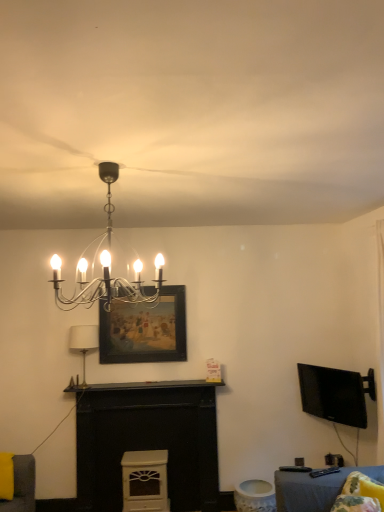
The width and height of the screenshot is (384, 512). What do you see at coordinates (360, 495) in the screenshot? I see `fluffy yellow pillow at lower right` at bounding box center [360, 495].

What do you see at coordinates (148, 441) in the screenshot?
I see `white matte fireplace at center` at bounding box center [148, 441].

Where is `white fabric lampshade at center-left, acting as the second lamp starting from the right`? white fabric lampshade at center-left, acting as the second lamp starting from the right is located at coordinates (83, 342).

Find the location of `fluffy yellow pillow at lower right`. fluffy yellow pillow at lower right is located at coordinates (360, 495).

Considering the sizes of objects black glossy tv at right and white matte fireplace at center in the image provided, who is smaller, black glossy tv at right or white matte fireplace at center?

Smaller between the two is black glossy tv at right.

Considering the positions of objects black glossy tv at right and white matte fireplace at center in the image provided, who is in front, black glossy tv at right or white matte fireplace at center?

black glossy tv at right is more forward.

Is black glossy tv at right spatially inside white matte fireplace at center, or outside of it?

black glossy tv at right is not inside white matte fireplace at center, it's outside.

From a real-world perspective, who is located higher, black glossy tv at right or white matte fireplace at center?

In real-world perspective, black glossy tv at right is above.

From a real-world perspective, which is physically below, fluffy yellow pillow at lower right or white matte fireplace at center?

white matte fireplace at center is physically lower.

Considering the relative sizes of fluffy yellow pillow at lower right and white matte fireplace at center in the image provided, is fluffy yellow pillow at lower right taller than white matte fireplace at center?

Incorrect, the height of fluffy yellow pillow at lower right is not larger of that of white matte fireplace at center.

Which object is closer to the camera, fluffy yellow pillow at lower right or white matte fireplace at center?

Positioned in front is fluffy yellow pillow at lower right.

Is fluffy yellow pillow at lower right looking in the opposite direction of white matte fireplace at center?

No.

Is white fabric lampshade at center-left, which ranks as the first lamp in left-to-right order, spatially inside white matte fireplace at center, or outside of it?

The correct answer is: outside.

Is white fabric lampshade at center-left, the 2th lamp positioned from the top, beside white matte fireplace at center?

No, white fabric lampshade at center-left, the 2th lamp positioned from the top, is not making contact with white matte fireplace at center.

Which is farther from the camera, (84, 346) or (136, 387)?

Point (84, 346)

Can you confirm if white fabric lampshade at center-left, which ranks as the first lamp in left-to-right order, is wider than white matte fireplace at center?

Indeed, white fabric lampshade at center-left, which ranks as the first lamp in left-to-right order, has a greater width compared to white matte fireplace at center.

Who is shorter, white fabric lampshade at center-left, which ranks as the first lamp in left-to-right order, or fluffy yellow pillow at lower right?

Standing shorter between the two is fluffy yellow pillow at lower right.

Can you confirm if white fabric lampshade at center-left, the 1th lamp from the bottom, is thinner than fluffy yellow pillow at lower right?

Yes.

Based on the photo, can you tell me how much black glossy tv at right and polished chrome chandelier at upper center, which is the first lamp in front-to-back order, differ in facing direction?

black glossy tv at right and polished chrome chandelier at upper center, which is the first lamp in front-to-back order, are facing 153 degrees away from each other.

From a real-world perspective, which is physically below, black glossy tv at right or polished chrome chandelier at upper center, placed as the first lamp when sorted from top to bottom?

black glossy tv at right is physically lower.

Considering the sizes of black glossy tv at right and polished chrome chandelier at upper center, placed as the 2th lamp when sorted from back to front, in the image, is black glossy tv at right wider or thinner than polished chrome chandelier at upper center, placed as the 2th lamp when sorted from back to front,?

black glossy tv at right is thinner than polished chrome chandelier at upper center, placed as the 2th lamp when sorted from back to front.

Which is behind, black glossy tv at right or polished chrome chandelier at upper center, placed as the 2th lamp when sorted from back to front?

black glossy tv at right is further from the camera.

From a real-world perspective, is wooden framed painting at center above or below fluffy yellow pillow at lower right?

In terms of real-world spatial position, wooden framed painting at center is above fluffy yellow pillow at lower right.

Can you confirm if wooden framed painting at center is shorter than fluffy yellow pillow at lower right?

No.

Considering the relative sizes of wooden framed painting at center and fluffy yellow pillow at lower right in the image provided, is wooden framed painting at center bigger than fluffy yellow pillow at lower right?

Indeed, wooden framed painting at center has a larger size compared to fluffy yellow pillow at lower right.

From the image's perspective, which is above, wooden framed painting at center or fluffy yellow pillow at lower right?

wooden framed painting at center appears higher in the image.

Is black glossy tv at right completely or partially outside of fluffy yellow pillow at lower right?

Yes.

Between point (359, 378) and point (335, 511), which one is positioned in front?

The point (335, 511) is closer.

In terms of height, does black glossy tv at right look taller or shorter compared to fluffy yellow pillow at lower right?

Clearly, black glossy tv at right is taller compared to fluffy yellow pillow at lower right.

Where is `television that is above the fluffy yellow pillow at lower right (from a real-world perspective)`? Image resolution: width=384 pixels, height=512 pixels. television that is above the fluffy yellow pillow at lower right (from a real-world perspective) is located at coordinates point(335,394).

Where is `fireplace below the black glossy tv at right (from the image's perspective)`? This screenshot has width=384, height=512. fireplace below the black glossy tv at right (from the image's perspective) is located at coordinates (148, 441).

Identify the location of fireplace that appears on the left of fluffy yellow pillow at lower right. The image size is (384, 512). (148, 441).

Which object lies further to the anchor point fluffy yellow pillow at lower right, white fabric lampshade at center-left, the 1th lamp from the bottom, or black glossy tv at right?

The object further to fluffy yellow pillow at lower right is white fabric lampshade at center-left, the 1th lamp from the bottom.

When comparing their distances from polished chrome chandelier at upper center, which ranks as the second lamp in bottom-to-top order, does white fabric lampshade at center-left, which is the first lamp in back-to-front order, or black glossy tv at right seem closer?

white fabric lampshade at center-left, which is the first lamp in back-to-front order, is positioned closer to the anchor polished chrome chandelier at upper center, which ranks as the second lamp in bottom-to-top order.

Estimate the real-world distances between objects in this image. Which object is closer to polished chrome chandelier at upper center, the 2th lamp from the left, white fabric lampshade at center-left, the 2th lamp positioned from the top, or wooden framed painting at center?

wooden framed painting at center lies closer to polished chrome chandelier at upper center, the 2th lamp from the left, than the other object.

Looking at the image, which one is located further to white matte fireplace at center, polished chrome chandelier at upper center, which ranks as the second lamp in bottom-to-top order, or black glossy tv at right?

polished chrome chandelier at upper center, which ranks as the second lamp in bottom-to-top order.

When comparing their distances from black glossy tv at right, does fluffy yellow pillow at lower right or white fabric lampshade at center-left, the 2th lamp positioned from the top, seem further?

The object further to black glossy tv at right is white fabric lampshade at center-left, the 2th lamp positioned from the top.

Based on their spatial positions, is wooden framed painting at center or white fabric lampshade at center-left, which is the first lamp in back-to-front order, closer to black glossy tv at right?

wooden framed painting at center is closer to black glossy tv at right.

When comparing their distances from fluffy yellow pillow at lower right, does polished chrome chandelier at upper center, which is the first lamp in front-to-back order, or white fabric lampshade at center-left, which is the first lamp in back-to-front order, seem closer?

Among the two, polished chrome chandelier at upper center, which is the first lamp in front-to-back order, is located nearer to fluffy yellow pillow at lower right.

Considering their positions, is fluffy yellow pillow at lower right positioned further to black glossy tv at right than wooden framed painting at center?

wooden framed painting at center is positioned further to the anchor black glossy tv at right.

The image size is (384, 512). In order to click on television between polished chrome chandelier at upper center, acting as the first lamp starting from the right, and wooden framed painting at center in the front-back direction in this screenshot , I will do `click(335, 394)`.

Where is `pillow between white matte fireplace at center and black glossy tv at right in the horizontal direction`? This screenshot has width=384, height=512. pillow between white matte fireplace at center and black glossy tv at right in the horizontal direction is located at coordinates (360, 495).

Identify the location of lamp located between white fabric lampshade at center-left, the second lamp from the front, and fluffy yellow pillow at lower right in the left-right direction. This screenshot has width=384, height=512. (101, 285).

Locate an element on the screen. television between polished chrome chandelier at upper center, the 2th lamp from the left, and white matte fireplace at center, along the z-axis is located at coordinates (335, 394).